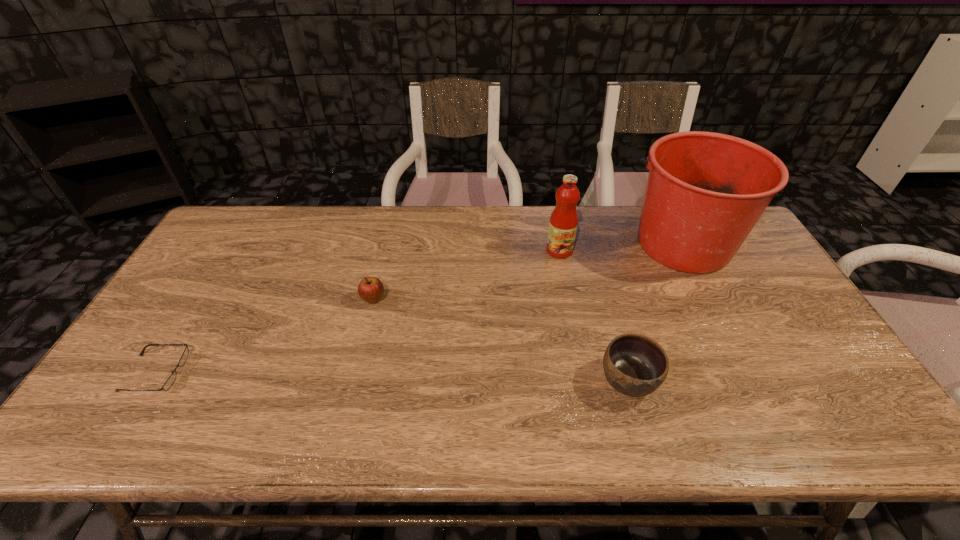
Find the location of a particular element. the rightmost object is located at coordinates (705, 191).

Identify the location of fruit juice. (563, 223).

At what (x,y) coordinates should I click in order to perform the action: click on bowl. Please return your answer as a coordinate pair (x, y). Looking at the image, I should click on (634, 364).

Where is `apple`? The image size is (960, 540). apple is located at coordinates (370, 289).

At what (x,y) coordinates should I click in order to perform the action: click on the second object from left to right. Please return your answer as a coordinate pair (x, y). The width and height of the screenshot is (960, 540). Looking at the image, I should click on pyautogui.click(x=370, y=289).

Where is `spectacles`? The height and width of the screenshot is (540, 960). spectacles is located at coordinates (182, 361).

Image resolution: width=960 pixels, height=540 pixels. In order to click on the shortest object in this screenshot , I will do `click(182, 361)`.

The image size is (960, 540). In order to click on vacant region located on the front of the bucket in this screenshot , I will do `click(713, 300)`.

The image size is (960, 540). In order to click on free location located 0.180m on the front label of the fruit juice in this screenshot , I will do `click(569, 301)`.

Where is `free space located 0.360m on the right of the bowl`? The image size is (960, 540). free space located 0.360m on the right of the bowl is located at coordinates (804, 380).